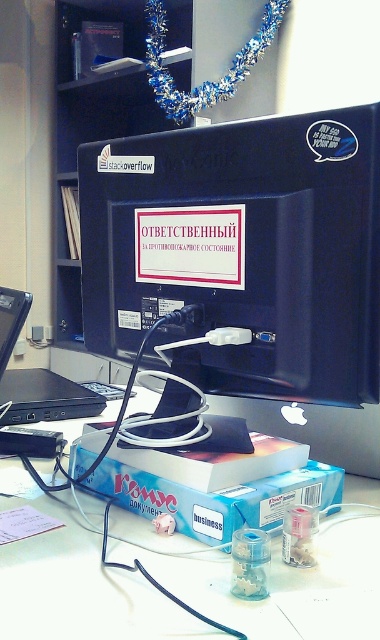
You are organizing a desk and need to ensure that the matte black monitor at center doesn not block the white plastic computer desk at center. Since the monitor is taller, how should you position them to avoid obstruction?

The matte black monitor at center is taller than the white plastic computer desk at center, so to prevent obstruction, position the monitor behind the desk or adjust its placement so it doesn not block the desk area.

You are organizing the desk and need to place a new keyboard. The keyboard requires a space that is not occupied by the matte black monitor at center or the white plastic computer desk at center. Where should you place it?

The matte black monitor at center is located above the white plastic computer desk at center, so placing the keyboard on the desk surface below the monitor would be a suitable space not occupied by either object.

You are a delivery person who just arrived at the office to drop off a package. You see the matte black monitor at center and the white plastic computer desk at center. The package is 12 inches long. Can you place the package between them without moving either object?

The distance between the matte black monitor at center and the white plastic computer desk at center is 13.20 inches. Since the package is 12 inches long, it can fit between them as there is enough space.